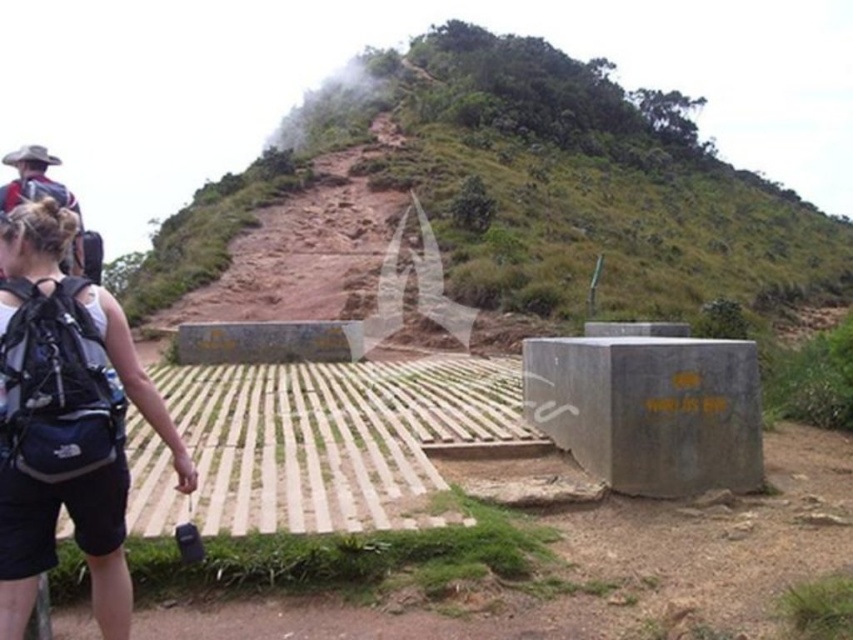
Question: Is brown dirt hillside at upper center bigger than dark blue fabric backpack at lower left?

Choices:
 (A) no
 (B) yes

Answer: (B)

Question: Which object is farther from the camera taking this photo?

Choices:
 (A) dark blue fabric backpack at lower left
 (B) brown dirt hillside at upper center

Answer: (B)

Question: Is brown dirt hillside at upper center closer to camera compared to dark blue fabric backpack at lower left?

Choices:
 (A) no
 (B) yes

Answer: (A)

Question: Is brown dirt hillside at upper center behind dark blue fabric backpack at lower left?

Choices:
 (A) yes
 (B) no

Answer: (A)